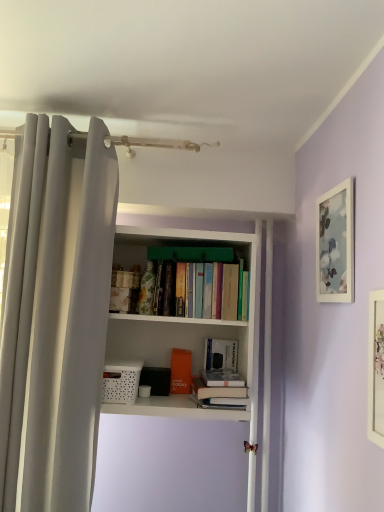
Question: In terms of width, does white fabric curtain at left look wider or thinner when compared to hardcover books at center, positioned as the first book in top-to-bottom order?

Choices:
 (A) thin
 (B) wide

Answer: (A)

Question: Considering the positions of white fabric curtain at left and hardcover books at center, which is the fourth book from bottom to top, in the image, is white fabric curtain at left taller or shorter than hardcover books at center, which is the fourth book from bottom to top,?

Choices:
 (A) tall
 (B) short

Answer: (A)

Question: Estimate the real-world distances between objects in this image. Which object is closer to the white matte picture frame at upper right, the second picture frame positioned from the front?

Choices:
 (A) hardcover book at center, marked as the 4th book in a top-to-bottom arrangement
 (B) white fabric curtain at left
 (C) orange matte book at center, placed as the second book when sorted from bottom to top
 (D) white matte book at center, acting as the 2th book starting from the top
 (E) white matte bookcase at center

Answer: (E)

Question: Which object is positioned closest to the white matte book at center, acting as the 2th book starting from the top?

Choices:
 (A) hardcover book at center, the 1th book from the bottom
 (B) white fabric curtain at left
 (C) orange matte book at center, which is counted as the third book, starting from the top
 (D) white matte picture frame at upper right, the second picture frame positioned from the front
 (E) hardcover books at center, positioned as the first book in top-to-bottom order

Answer: (C)